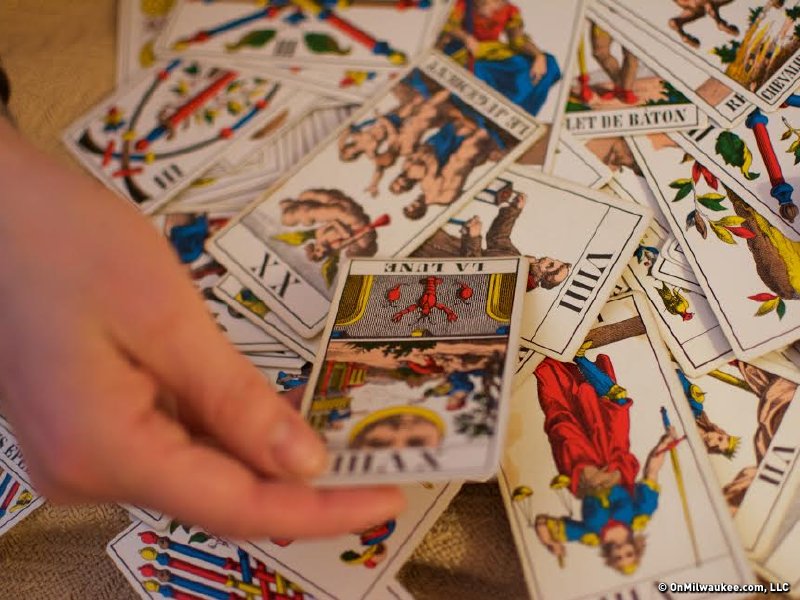
Identify the location of scales. The height and width of the screenshot is (600, 800). (528, 497), (562, 486).